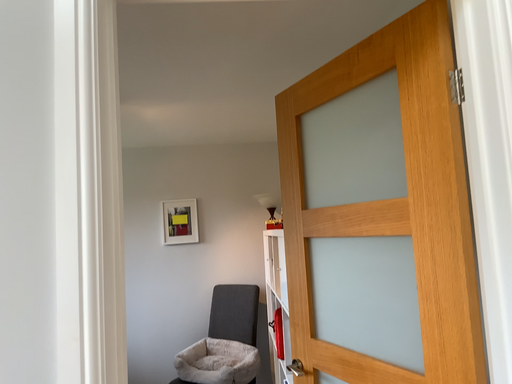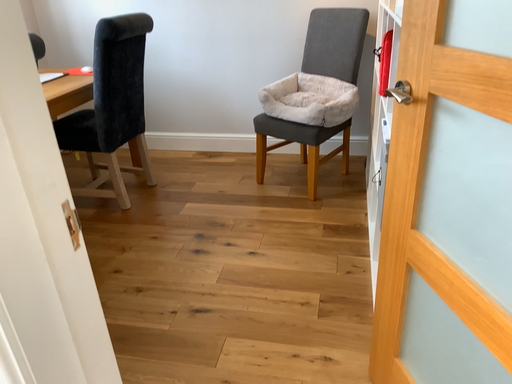
Question: Which way did the camera rotate in the video?

Choices:
 (A) rotated left
 (B) rotated right

Answer: (A)